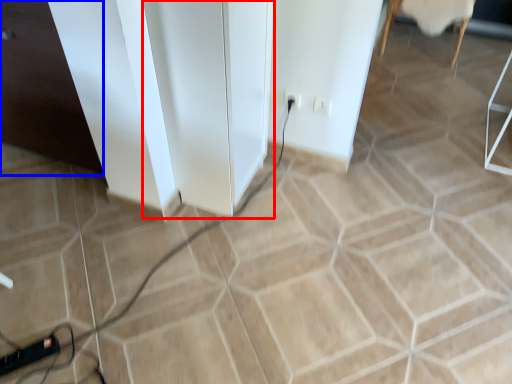
Question: Which of the following is the farthest to the observer, file cabinet (highlighted by a red box) or file cabinet (highlighted by a blue box)?

Choices:
 (A) file cabinet
 (B) file cabinet

Answer: (B)